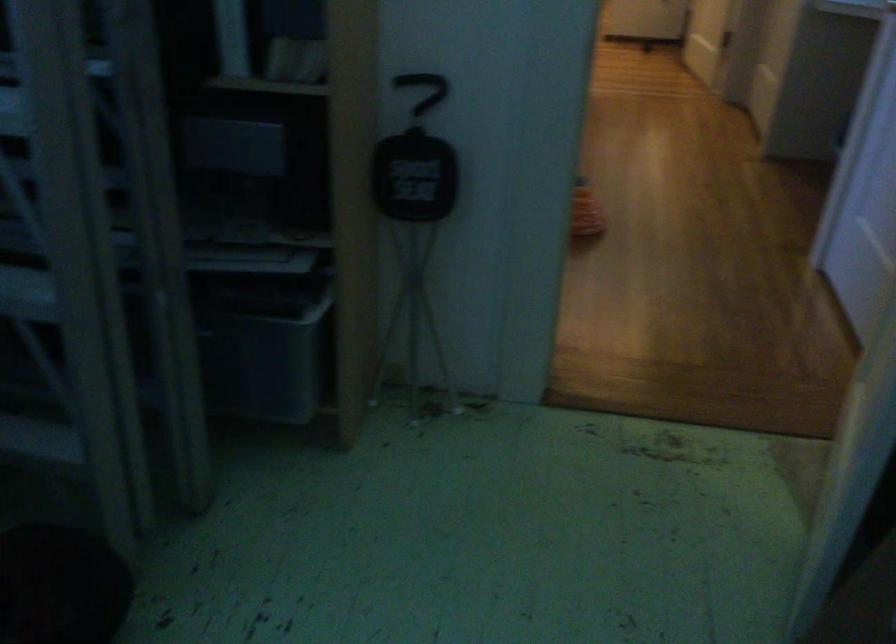
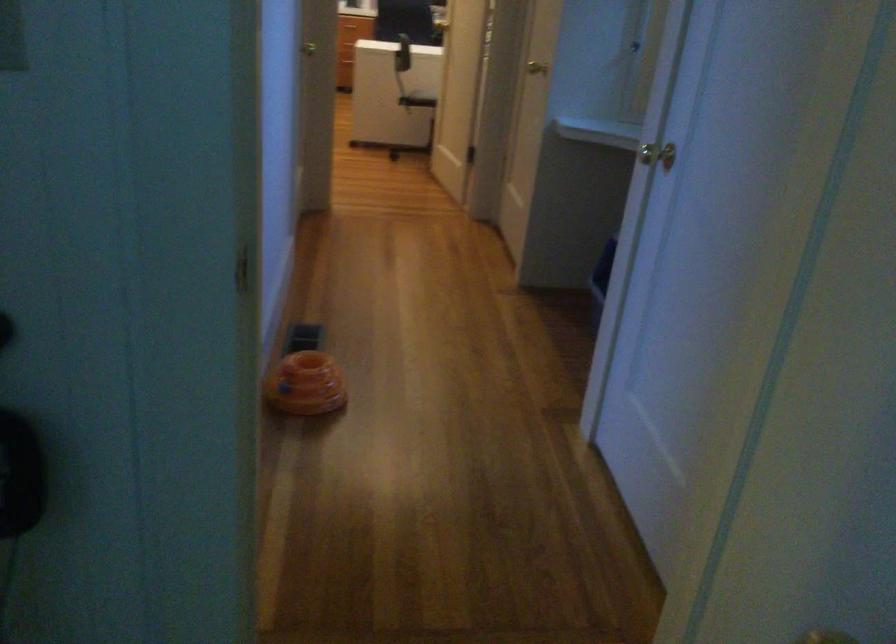
Question: The camera is either moving clockwise (left) or counter-clockwise (right) around the object. The first image is from the beginning of the video and the second image is from the end. Is the camera moving left or right when shooting the video?

Choices:
 (A) Left
 (B) Right

Answer: (A)